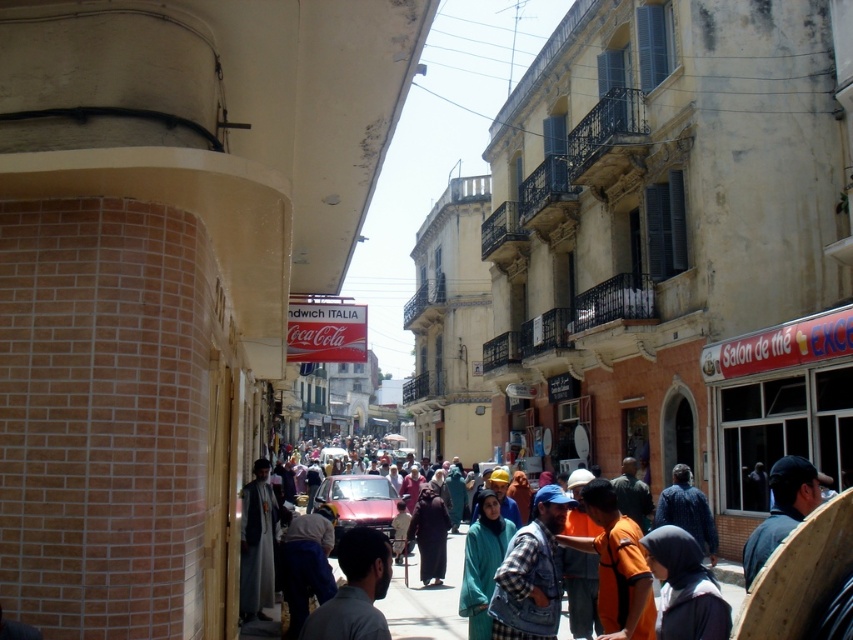
Question: Among these objects, which one is farthest from the camera?

Choices:
 (A) dark gray shirt at center
 (B) dark blue fabric cap at lower right

Answer: (B)

Question: Which object is positioned farthest from the gray fabric coat at center?

Choices:
 (A) dark gray shirt at center
 (B) orange fabric shirt at center

Answer: (B)

Question: Can you confirm if denim jacket at center is wider than dark gray shirt at center?

Choices:
 (A) no
 (B) yes

Answer: (B)

Question: Is orange fabric shirt at center to the right of blue denim jacket at center from the viewer's perspective?

Choices:
 (A) yes
 (B) no

Answer: (B)

Question: Is matte black hijab at lower right above dark blue fabric cap at lower right?

Choices:
 (A) no
 (B) yes

Answer: (A)

Question: Based on their relative distances, which object is nearer to the matte black hijab at lower right?

Choices:
 (A) dark brown fabric at center
 (B) blue denim jacket at center

Answer: (B)